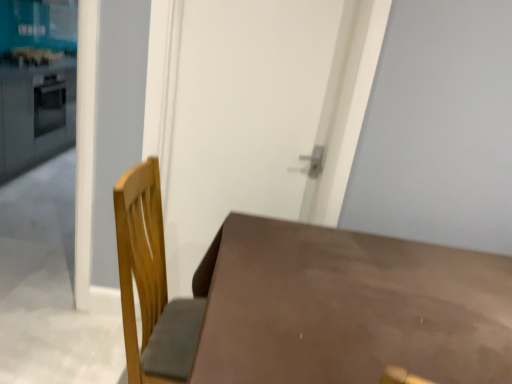
Question: Is matte white counter top at upper left, the 2th counter top in the bottom-to-top sequence, completely or partially inside brown matte table at lower left?

Choices:
 (A) no
 (B) yes

Answer: (A)

Question: From a real-world perspective, is brown matte table at lower left physically below matte white counter top at upper left, which appears as the 1th counter top when viewed from the top?

Choices:
 (A) yes
 (B) no

Answer: (A)

Question: Could you tell me if brown matte table at lower left is facing matte white counter top at upper left, the 2th counter top in the bottom-to-top sequence?

Choices:
 (A) yes
 (B) no

Answer: (B)

Question: Is brown matte table at lower left to the right of matte white counter top at upper left, the 2th counter top in the bottom-to-top sequence, from the viewer's perspective?

Choices:
 (A) no
 (B) yes

Answer: (B)

Question: Can you confirm if brown matte table at lower left is smaller than matte white counter top at upper left, the 2th counter top in the bottom-to-top sequence?

Choices:
 (A) yes
 (B) no

Answer: (B)

Question: Considering the positions of point (339, 337) and point (314, 29), is point (339, 337) closer or farther from the camera than point (314, 29)?

Choices:
 (A) farther
 (B) closer

Answer: (B)

Question: In terms of width, does brown matte table at lower left look wider or thinner when compared to matte brown door at center?

Choices:
 (A) wide
 (B) thin

Answer: (A)

Question: From a real-world perspective, relative to matte brown door at center, is brown matte table at lower left vertically above or below?

Choices:
 (A) below
 (B) above

Answer: (A)

Question: From the image's perspective, is brown matte table at lower left positioned above or below matte brown door at center?

Choices:
 (A) above
 (B) below

Answer: (B)

Question: Looking at their shapes, would you say matte white counter top at left, positioned as the second counter top in top-to-bottom order, is wider or thinner than brown matte table at lower left?

Choices:
 (A) wide
 (B) thin

Answer: (B)

Question: Looking at the image, does matte white counter top at left, positioned as the second counter top in top-to-bottom order, seem bigger or smaller compared to brown matte table at lower left?

Choices:
 (A) big
 (B) small

Answer: (B)

Question: In the image, is matte white counter top at left, positioned as the second counter top in top-to-bottom order, positioned in front of or behind brown matte table at lower left?

Choices:
 (A) front
 (B) behind

Answer: (B)

Question: Considering the relative positions of matte white counter top at left, the first counter top when ordered from bottom to top, and brown matte table at lower left in the image provided, is matte white counter top at left, the first counter top when ordered from bottom to top, to the left or to the right of brown matte table at lower left?

Choices:
 (A) left
 (B) right

Answer: (A)

Question: Considering the positions of matte white counter top at upper left, which appears as the 1th counter top when viewed from the top, and matte brown door at center in the image, is matte white counter top at upper left, which appears as the 1th counter top when viewed from the top, taller or shorter than matte brown door at center?

Choices:
 (A) tall
 (B) short

Answer: (B)

Question: From a real-world perspective, is matte white counter top at upper left, the 2th counter top in the bottom-to-top sequence, positioned above or below matte brown door at center?

Choices:
 (A) below
 (B) above

Answer: (A)